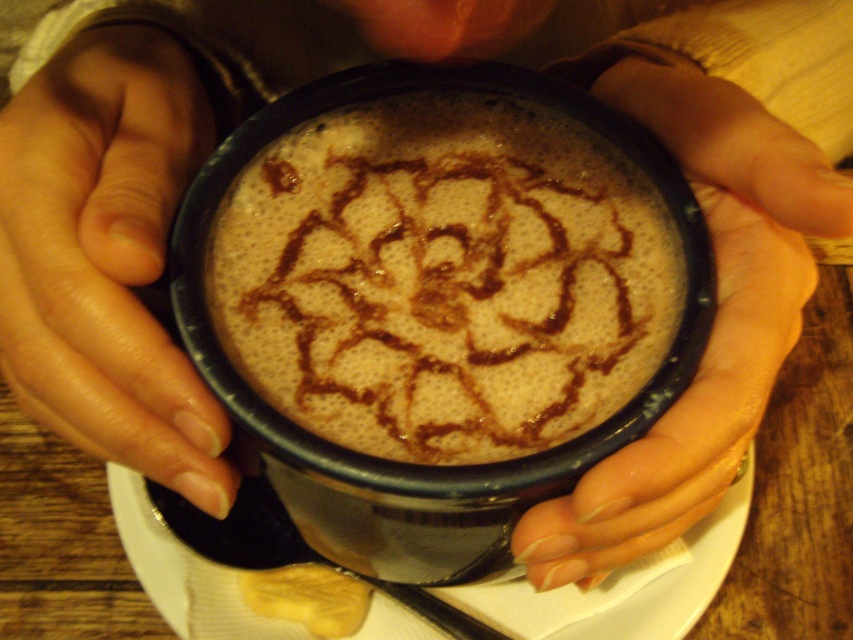
Does nail polish coated nails at lower left have a lesser height compared to nail polish coated fingers at center?

Correct, nail polish coated nails at lower left is not as tall as nail polish coated fingers at center.

Is point (97, 355) positioned before point (525, 538)?

Yes, point (97, 355) is closer to viewer.

Is point (131, 120) less distant than point (764, 220)?

That is False.

At what (x,y) coordinates should I click in order to perform the action: click on nail polish coated nails at lower left. Please return your answer as a coordinate pair (x, y). Image resolution: width=853 pixels, height=640 pixels. Looking at the image, I should click on (106, 256).

Looking at this image, how far apart are nail polish coated fingers at center and white paper napkin at center?

The distance of nail polish coated fingers at center from white paper napkin at center is 13.27 centimeters.

Which is below, nail polish coated fingers at center or white paper napkin at center?

white paper napkin at center

Is point (735, 240) behind point (666, 595)?

No, (735, 240) is in front of (666, 595).

Find the location of a particular element. The width and height of the screenshot is (853, 640). nail polish coated fingers at center is located at coordinates (x=712, y=321).

Does point (605, 348) come in front of point (172, 381)?

That is False.

Locate an element on the screen. The width and height of the screenshot is (853, 640). brown frothy coffee at center is located at coordinates (444, 276).

Is point (440, 93) closer to viewer compared to point (4, 250)?

No, it is not.

At what (x,y) coordinates should I click in order to perform the action: click on brown frothy coffee at center. Please return your answer as a coordinate pair (x, y). The image size is (853, 640). Looking at the image, I should click on (444, 276).